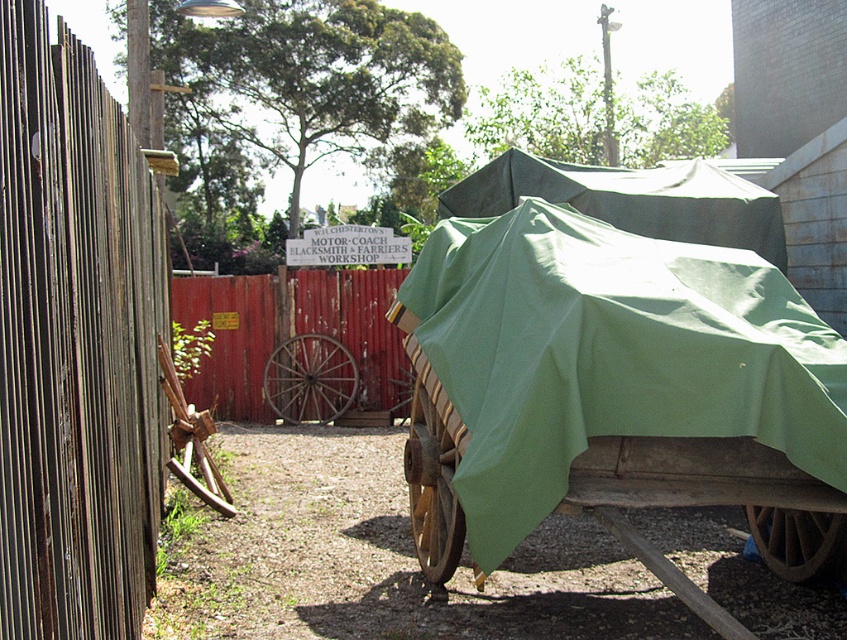
Does wooden planks at left have a smaller size compared to red wood fence at center?

No, wooden planks at left is not smaller than red wood fence at center.

Is point (21, 220) closer to viewer compared to point (259, 346)?

Yes, point (21, 220) is closer to viewer.

You are a GUI agent. You are given a task and a screenshot of the screen. Output one action in this format:
    pyautogui.click(x=<x>, y=<y>)
    Task: Click on the wooden planks at left
    This screenshot has width=847, height=640.
    Given the screenshot: What is the action you would take?
    pyautogui.click(x=75, y=342)

Who is higher up, green fabric-covered wagon at center or red wood fence at center?

red wood fence at center is above.

Is green fabric-covered wagon at center to the left of red wood fence at center from the viewer's perspective?

In fact, green fabric-covered wagon at center is to the right of red wood fence at center.

Measure the distance between green fabric-covered wagon at center and camera.

A distance of 4.18 meters exists between green fabric-covered wagon at center and camera.

Identify the location of green fabric-covered wagon at center. (687, 496).

Does red wood fence at center have a larger size compared to green fabric cart at center?

Correct, red wood fence at center is larger in size than green fabric cart at center.

This screenshot has width=847, height=640. I want to click on red wood fence at center, so click(291, 333).

Is point (194, 291) behind point (745, 186)?

Yes.

The width and height of the screenshot is (847, 640). Find the location of `red wood fence at center`. red wood fence at center is located at coordinates (291, 333).